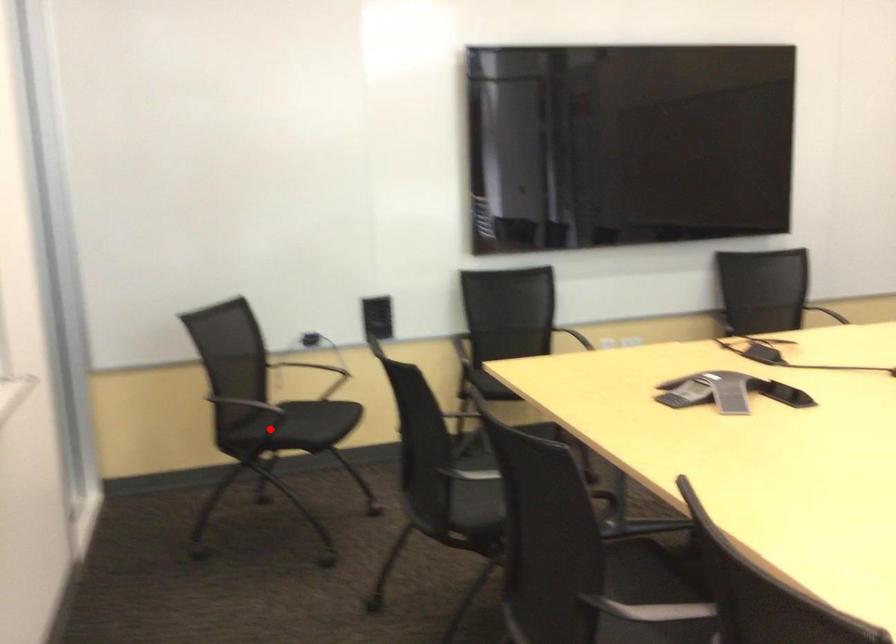
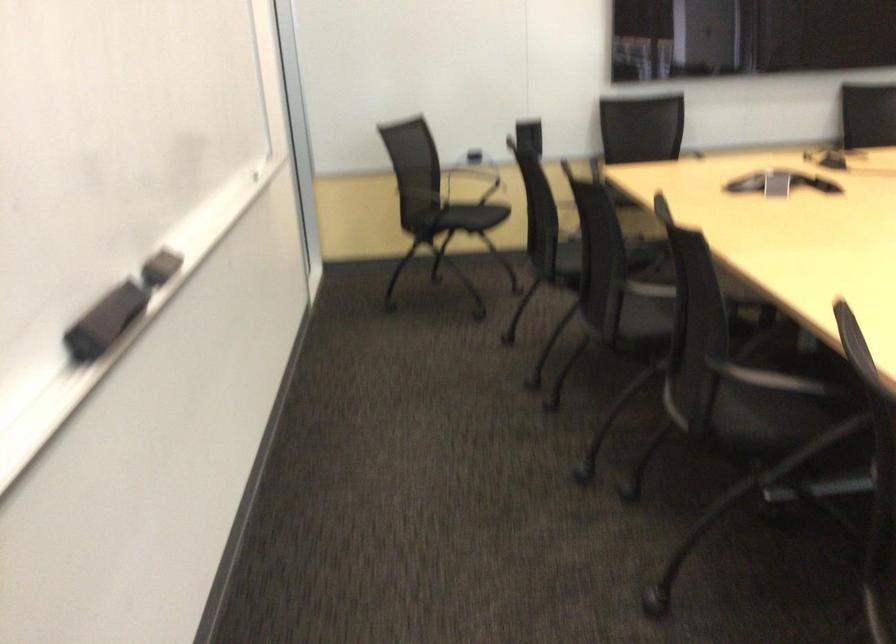
Where in the second image is the point corresponding to the highlighted location from the first image?

(448, 216)